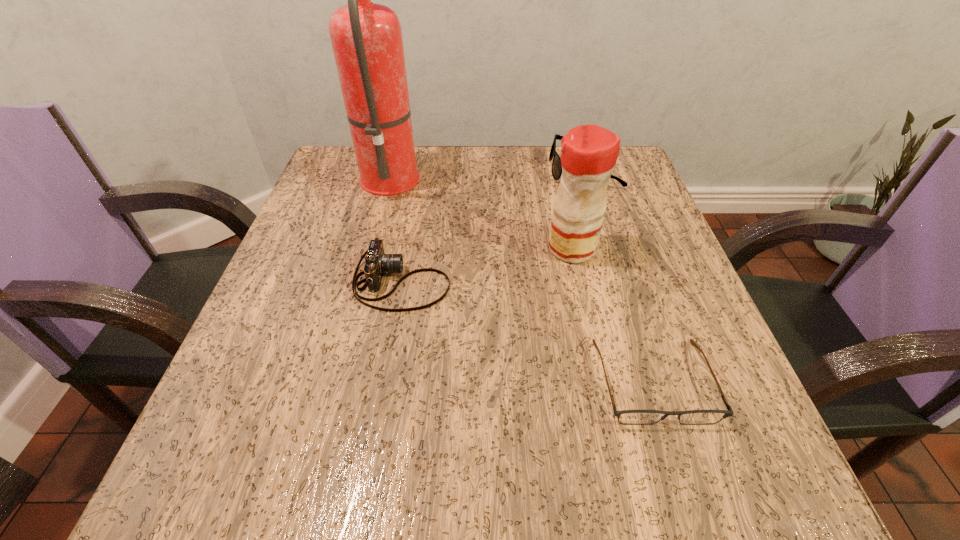
Where is `free space between the condiment and the camera`? The height and width of the screenshot is (540, 960). free space between the condiment and the camera is located at coordinates (487, 265).

Where is `free space between the fire extinguisher and the shortest object`? free space between the fire extinguisher and the shortest object is located at coordinates (522, 278).

Identify the location of vacant point located between the shortest object and the camera. This screenshot has width=960, height=540. (527, 332).

The width and height of the screenshot is (960, 540). In order to click on free point between the fire extinguisher and the spectacles in this screenshot , I will do `click(522, 278)`.

Locate an element on the screen. unoccupied position between the camera and the spectacles is located at coordinates (x=527, y=332).

Choose which object is the third nearest neighbor to the shortest object. Please provide its 2D coordinates. Your answer should be formatted as a tuple, i.e. [(x, y)], where the tuple contains the x and y coordinates of a point satisfying the conditions above.

[(556, 169)]

Point out which object is positioned as the nearest to the camera. Please provide its 2D coordinates. Your answer should be formatted as a tuple, i.e. [(x, y)], where the tuple contains the x and y coordinates of a point satisfying the conditions above.

[(366, 37)]

The image size is (960, 540). I want to click on vacant area that satisfies the following two spatial constraints: 1. with the handle and hose on the condiment; 2. on the left side of the tallest object, so click(372, 249).

Where is `free space that satisfies the following two spatial constraints: 1. with the handle and hose on the fire extinguisher; 2. on the right side of the fourth shortest object`? The image size is (960, 540). free space that satisfies the following two spatial constraints: 1. with the handle and hose on the fire extinguisher; 2. on the right side of the fourth shortest object is located at coordinates (372, 249).

Where is `free space that satisfies the following two spatial constraints: 1. with the handle and hose on the second tallest object; 2. on the left side of the fire extinguisher`? Image resolution: width=960 pixels, height=540 pixels. free space that satisfies the following two spatial constraints: 1. with the handle and hose on the second tallest object; 2. on the left side of the fire extinguisher is located at coordinates (372, 249).